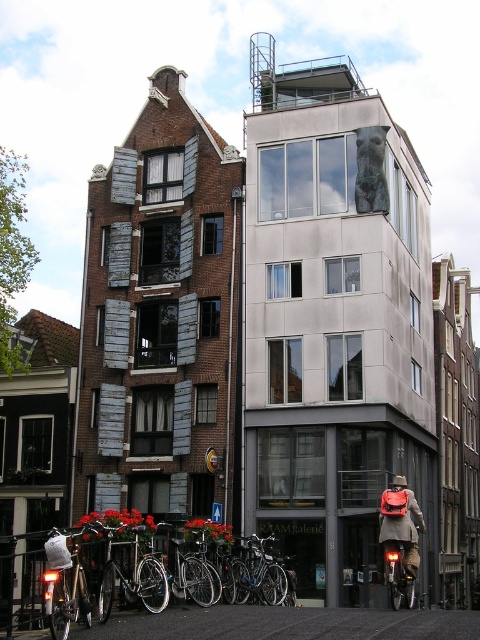
You are a delivery person who needs to park your silver metallic bicycle at lower left and your matte black backpack at lower right near the traditional brick building. Given their positions, which item is closer to the traditional brick building?

The silver metallic bicycle at lower left is closer to the traditional brick building because it is positioned to the left of the matte black backpack at lower right, and the traditional brick building is on the left side of the image.

You are standing at point (100, 577) in the image. What object is located at this point?

The silver metallic bicycle at lower left is located at point (100, 577).

You are a delivery person who needs to load both the silver metallic bicycle at lower left and the matte black backpack at lower right into a van with a height limit of 1.5 meters. Can both items fit vertically without exceeding the height limit?

The silver metallic bicycle at lower left is much taller than the matte black backpack at lower right. Since the bicycle is taller, it might exceed the van height limit of 1.5 meters. The backpack is shorter, so it would fit. However, without knowing the exact height of the bicycle, we cannot confirm if both will fit.